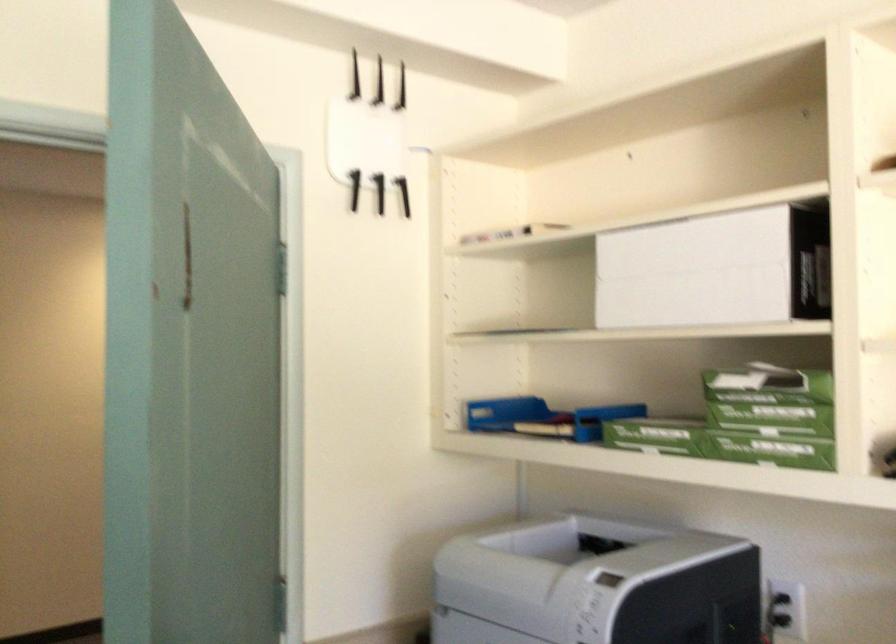
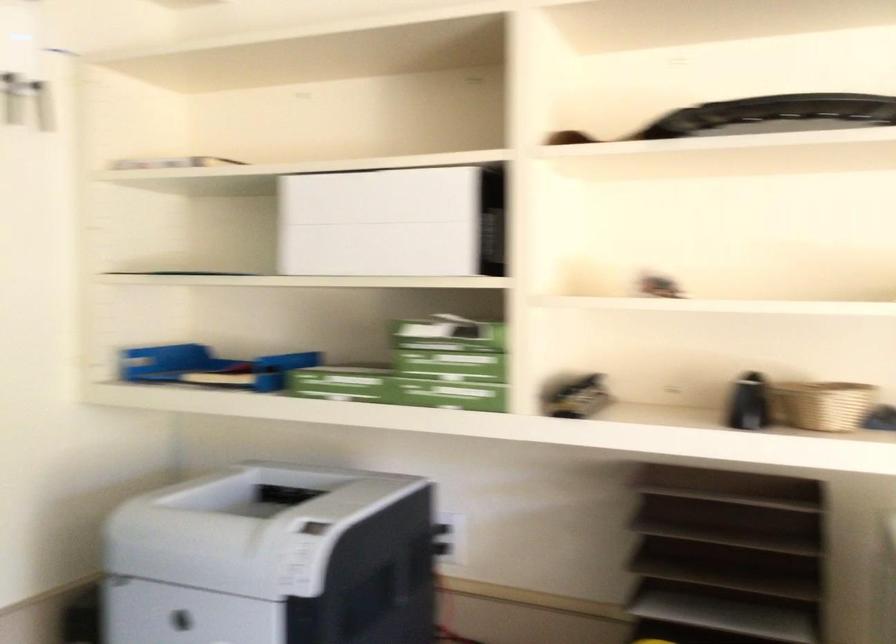
In the second image, find the point that corresponds to pixel 547 576 in the first image.

(246, 527)